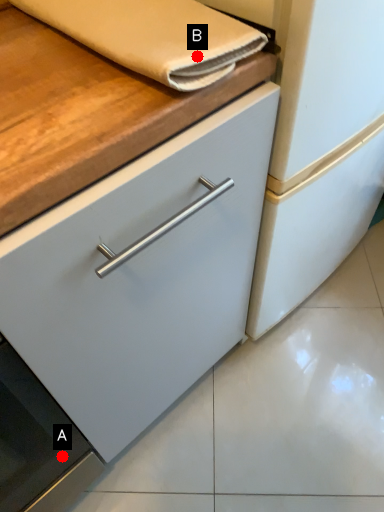
Question: Two points are circled on the image, labeled by A and B beside each circle. Which of the following is the closest to the observer?

Choices:
 (A) A is closer
 (B) B is closer

Answer: (B)